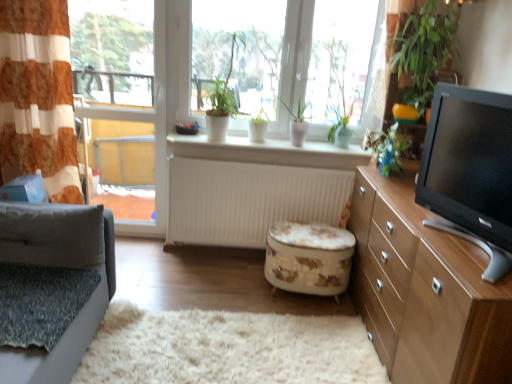
Locate an element on the screen. The image size is (512, 384). free area below black glossy tv at right (from a real-world perspective) is located at coordinates (449, 243).